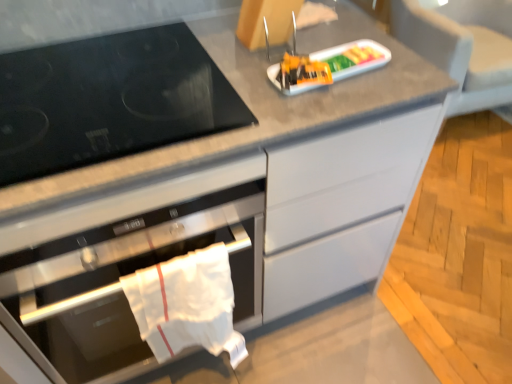
The height and width of the screenshot is (384, 512). Identify the location of black glass gas stove at left. (109, 100).

Where is `gray fabric armchair at upper right`? gray fabric armchair at upper right is located at coordinates (462, 48).

This screenshot has width=512, height=384. Describe the element at coordinates (462, 48) in the screenshot. I see `gray fabric armchair at upper right` at that location.

The width and height of the screenshot is (512, 384). In order to click on stainless steel oven at center in this screenshot , I will do `click(118, 280)`.

Is white cloth towel at lower left far away from black glass gas stove at left?

No, white cloth towel at lower left is in close proximity to black glass gas stove at left.

Can black glass gas stove at left be found inside white cloth towel at lower left?

No, black glass gas stove at left is located outside of white cloth towel at lower left.

Visually, is white cloth towel at lower left positioned to the left or to the right of black glass gas stove at left?

From the image, it's evident that white cloth towel at lower left is to the right of black glass gas stove at left.

Can you confirm if stainless steel oven at center is bigger than black glass gas stove at left?

Yes.

From the image's perspective, between stainless steel oven at center and black glass gas stove at left, who is located below?

stainless steel oven at center is shown below in the image.

Is stainless steel oven at center not inside black glass gas stove at left?

Yes.

Can you confirm if stainless steel oven at center is thinner than black glass gas stove at left?

No.

Does white cloth towel at lower left turn towards gray fabric armchair at upper right?

No, white cloth towel at lower left is not turned towards gray fabric armchair at upper right.

Between point (161, 316) and point (437, 23), which one is positioned in front?

The point (161, 316) is closer to the camera.

Measure the distance from white cloth towel at lower left to gray fabric armchair at upper right.

The distance of white cloth towel at lower left from gray fabric armchair at upper right is 5.65 feet.

From the image's perspective, who appears lower, stainless steel oven at center or plastic tray at center?

stainless steel oven at center.

Which is in front, stainless steel oven at center or plastic tray at center?

stainless steel oven at center is in front.

Between stainless steel oven at center and plastic tray at center, which one has larger width?

With larger width is stainless steel oven at center.

Between plastic tray at center and black glass gas stove at left, which one is positioned behind?

Positioned behind is plastic tray at center.

Are plastic tray at center and black glass gas stove at left far apart?

No, plastic tray at center is not far away from black glass gas stove at left.

How much distance is there between plastic tray at center and black glass gas stove at left?

plastic tray at center is 33.33 centimeters away from black glass gas stove at left.

How different are the orientations of plastic tray at center and black glass gas stove at left in degrees?

There is a 5.26-degree angle between the facing directions of plastic tray at center and black glass gas stove at left.

Find the location of a particular element. The image size is (512, 384). oven below the gray fabric armchair at upper right (from the image's perspective) is located at coordinates (118, 280).

Considering their positions, is gray fabric armchair at upper right located in front of or behind stainless steel oven at center?

Visually, gray fabric armchair at upper right is located behind stainless steel oven at center.

From a real-world perspective, does gray fabric armchair at upper right sit lower than stainless steel oven at center?

Yes.

Is gray fabric armchair at upper right turned away from stainless steel oven at center?

That's not correct — gray fabric armchair at upper right is not looking away from stainless steel oven at center.

Identify the location of appliance above the stainless steel oven at center (from a real-world perspective). (326, 66).

Considering the sizes of plastic tray at center and stainless steel oven at center in the image, is plastic tray at center taller or shorter than stainless steel oven at center?

plastic tray at center is shorter than stainless steel oven at center.

Is plastic tray at center inside the boundaries of stainless steel oven at center, or outside?

plastic tray at center is outside stainless steel oven at center.

Looking at this image, from the image's perspective, is plastic tray at center over stainless steel oven at center?

Yes, from the image's perspective, plastic tray at center is on top of stainless steel oven at center.

Locate an element on the screen. The image size is (512, 384). gas stove lying in front of the white cloth towel at lower left is located at coordinates (109, 100).

The image size is (512, 384). What are the coordinates of `gas stove behind the stainless steel oven at center` in the screenshot? It's located at (109, 100).

From the picture: Which object lies further to the anchor point plastic tray at center, gray fabric armchair at upper right or black glass gas stove at left?

gray fabric armchair at upper right is further to plastic tray at center.

Which object lies nearer to the anchor point stainless steel oven at center, black glass gas stove at left or plastic tray at center?

Based on the image, black glass gas stove at left appears to be nearer to stainless steel oven at center.

Based on their spatial positions, is plastic tray at center or stainless steel oven at center further from black glass gas stove at left?

plastic tray at center is positioned further to the anchor black glass gas stove at left.

Looking at this image, which object lies nearer to the anchor point plastic tray at center, stainless steel oven at center or black glass gas stove at left?

Based on the image, black glass gas stove at left appears to be nearer to plastic tray at center.

Considering their positions, is gray fabric armchair at upper right positioned further to plastic tray at center than white cloth towel at lower left?

Based on the image, gray fabric armchair at upper right appears to be further to plastic tray at center.

Which object lies further to the anchor point white cloth towel at lower left, plastic tray at center or black glass gas stove at left?

plastic tray at center is further to white cloth towel at lower left.

Consider the image. From the image, which object appears to be nearer to plastic tray at center, white cloth towel at lower left or black glass gas stove at left?

black glass gas stove at left is closer to plastic tray at center.

Which object lies nearer to the anchor point black glass gas stove at left, stainless steel oven at center or plastic tray at center?

Among the two, stainless steel oven at center is located nearer to black glass gas stove at left.

Identify the location of material situated between stainless steel oven at center and gray fabric armchair at upper right from left to right. Image resolution: width=512 pixels, height=384 pixels. (186, 304).

At what (x,y) coordinates should I click in order to perform the action: click on appliance situated between white cloth towel at lower left and gray fabric armchair at upper right from left to right. Please return your answer as a coordinate pair (x, y). Looking at the image, I should click on (326, 66).

You are a GUI agent. You are given a task and a screenshot of the screen. Output one action in this format:
    pyautogui.click(x=<x>, y=<y>)
    Task: Click on the appliance between stainless steel oven at center and gray fabric armchair at upper right from left to right
    This screenshot has height=384, width=512.
    Given the screenshot: What is the action you would take?
    pyautogui.click(x=326, y=66)

This screenshot has width=512, height=384. I want to click on gas stove situated between stainless steel oven at center and gray fabric armchair at upper right from left to right, so click(x=109, y=100).